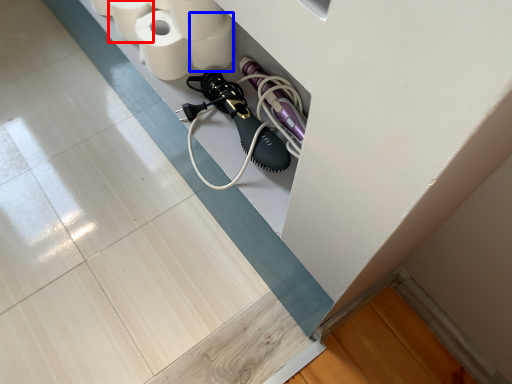
Question: Which of the following is the closest to the observer, toilet paper (highlighted by a red box) or toilet paper (highlighted by a blue box)?

Choices:
 (A) toilet paper
 (B) toilet paper

Answer: (B)